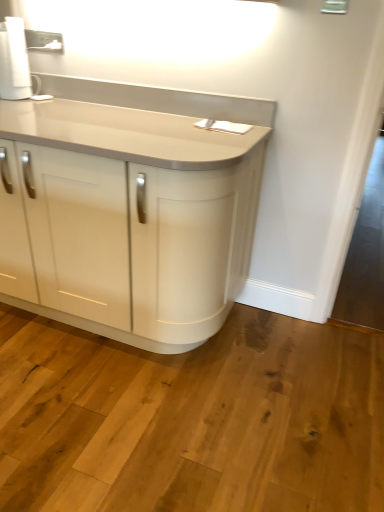
Question: Does matte white cabinet at center have a smaller size compared to white matte paper towel at upper left?

Choices:
 (A) yes
 (B) no

Answer: (B)

Question: Is matte white cabinet at center shorter than white matte paper towel at upper left?

Choices:
 (A) no
 (B) yes

Answer: (A)

Question: Does matte white cabinet at center turn towards white matte paper towel at upper left?

Choices:
 (A) no
 (B) yes

Answer: (A)

Question: Does matte white cabinet at center touch white matte paper towel at upper left?

Choices:
 (A) no
 (B) yes

Answer: (A)

Question: Can you confirm if matte white cabinet at center is positioned to the right of white matte paper towel at upper left?

Choices:
 (A) yes
 (B) no

Answer: (A)

Question: From the image's perspective, is matte white cabinet at center on top of white matte paper towel at upper left?

Choices:
 (A) no
 (B) yes

Answer: (A)

Question: Does white matte paper towel at upper left touch matte white cabinet at center?

Choices:
 (A) no
 (B) yes

Answer: (A)

Question: Can you confirm if white matte paper towel at upper left is taller than matte white cabinet at center?

Choices:
 (A) no
 (B) yes

Answer: (A)

Question: Is the depth of white matte paper towel at upper left greater than that of matte white cabinet at center?

Choices:
 (A) no
 (B) yes

Answer: (B)

Question: Is white matte paper towel at upper left not near matte white cabinet at center?

Choices:
 (A) yes
 (B) no

Answer: (B)

Question: Is white matte paper towel at upper left bigger than matte white cabinet at center?

Choices:
 (A) yes
 (B) no

Answer: (B)

Question: From the image's perspective, is white matte paper towel at upper left below matte white cabinet at center?

Choices:
 (A) yes
 (B) no

Answer: (B)

Question: Would you say white matte paper towel at upper left is inside or outside matte white cabinet at center?

Choices:
 (A) inside
 (B) outside

Answer: (A)